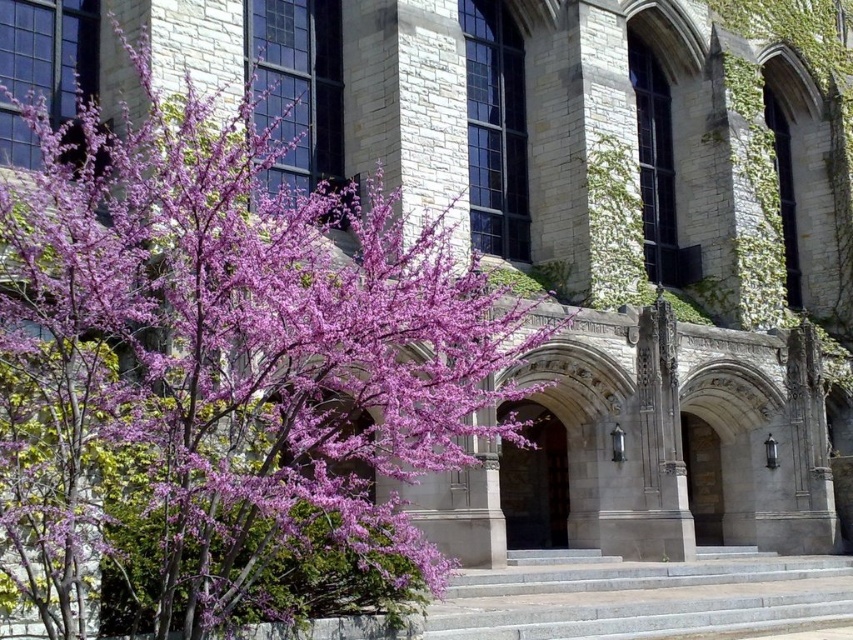
Question: Which of the following is the farthest from the observer?

Choices:
 (A) purple matte tree at left
 (B) gray stone stairs at center

Answer: (B)

Question: Can you confirm if purple matte tree at left is positioned to the right of gray stone stairs at center?

Choices:
 (A) no
 (B) yes

Answer: (A)

Question: Does purple matte tree at left have a greater width compared to gray stone stairs at center?

Choices:
 (A) no
 (B) yes

Answer: (B)

Question: Is purple matte tree at left thinner than gray stone stairs at center?

Choices:
 (A) yes
 (B) no

Answer: (B)